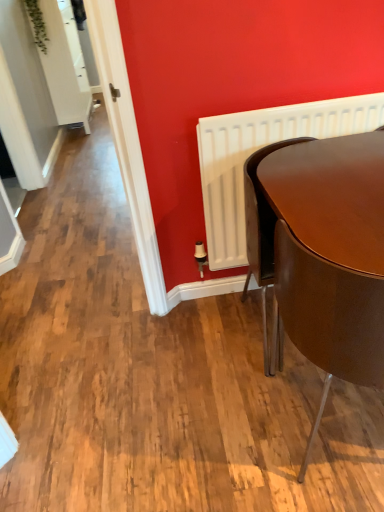
Question: From the image's perspective, is white matte radiator at right positioned above or below glossy brown table at lower right?

Choices:
 (A) below
 (B) above

Answer: (B)

Question: Does point coord(226,120) appear closer or farther from the camera than point coord(342,312)?

Choices:
 (A) farther
 (B) closer

Answer: (A)

Question: Which object is the closest to the matte brown chair at right?

Choices:
 (A) white matte radiator at right
 (B) glossy brown table at lower right

Answer: (B)

Question: Estimate the real-world distances between objects in this image. Which object is closer to the matte brown chair at right?

Choices:
 (A) white matte radiator at right
 (B) glossy brown table at lower right

Answer: (B)